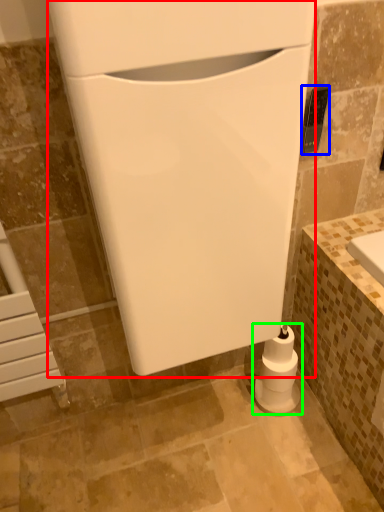
Question: Which object is the closest to the appliance (highlighted by a red box)? Choose among these: appliance (highlighted by a blue box) or toilet paper (highlighted by a green box).

Choices:
 (A) appliance
 (B) toilet paper

Answer: (A)